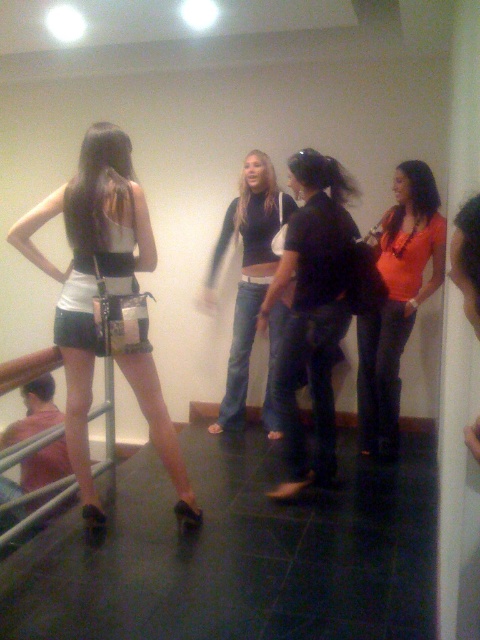
Can you confirm if matte black dress at left is taller than jeans at center?

In fact, matte black dress at left may be shorter than jeans at center.

Between matte black dress at left and jeans at center, which one appears on the left side from the viewer's perspective?

matte black dress at left

Describe the element at coordinates (91, 273) in the screenshot. I see `matte black dress at left` at that location.

The image size is (480, 640). Find the location of `matte black dress at left`. matte black dress at left is located at coordinates (91, 273).

Does denim jeans at center appear on the right side of jeans at center?

Yes, denim jeans at center is to the right of jeans at center.

From the picture: Is denim jeans at center positioned in front of jeans at center?

Yes, denim jeans at center is in front of jeans at center.

Is point (342, 284) farther from viewer compared to point (273, 208)?

No, it is not.

The image size is (480, 640). I want to click on denim jeans at center, so click(x=312, y=308).

Based on the photo, is matte black dress at left to the left of denim jeans at center from the viewer's perspective?

Correct, you'll find matte black dress at left to the left of denim jeans at center.

Is matte black dress at left further to the viewer compared to denim jeans at center?

No, it is not.

Does point (117, 276) come in front of point (292, 452)?

Yes, it is.

Identify the location of matte black dress at left. The height and width of the screenshot is (640, 480). (91, 273).